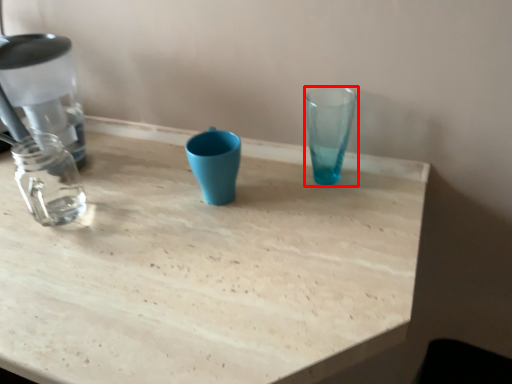
Question: From the image's perspective, what is the correct spatial positioning of vase (annotated by the red box) in reference to table?

Choices:
 (A) below
 (B) above

Answer: (B)